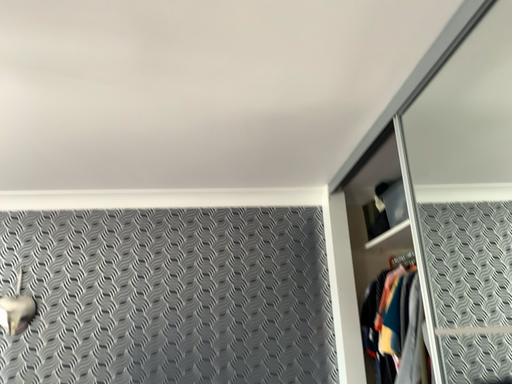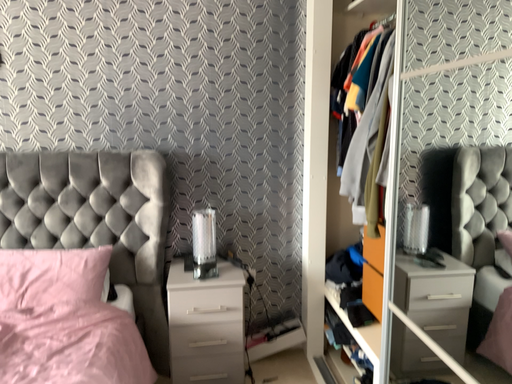
Question: How did the camera likely rotate when shooting the video?

Choices:
 (A) rotated upward
 (B) rotated downward

Answer: (B)